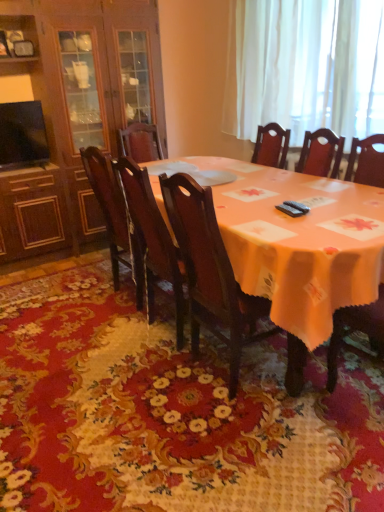
Identify the location of dark wood chair at center, the 3th chair viewed from the left. This screenshot has width=384, height=512. (211, 272).

What do you see at coordinates (211, 272) in the screenshot? I see `dark wood chair at center, the 3th chair viewed from the left` at bounding box center [211, 272].

The image size is (384, 512). I want to click on polished dark wood chair at center, marked as the 1th chair in a left-to-right arrangement, so click(x=114, y=217).

Identify the location of dark wood chair at center, which is counted as the 2th chair, starting from the right. This screenshot has height=512, width=384. (152, 239).

Measure the distance between wooden cabinet at left and camera.

They are 8.82 feet apart.

Where is `matte orange tablecloth at center`? The image size is (384, 512). matte orange tablecloth at center is located at coordinates (295, 247).

Where is `dark wood chair at center, the 3th chair viewed from the left`? dark wood chair at center, the 3th chair viewed from the left is located at coordinates (211, 272).

Does point (94, 190) appear closer or farther from the camera than point (306, 117)?

Point (94, 190).

Considering the sizes of polished dark wood chair at center, which ranks as the 3th chair in right-to-left order, and white sheer curtain at upper right in the image, is polished dark wood chair at center, which ranks as the 3th chair in right-to-left order, bigger or smaller than white sheer curtain at upper right?

Considering their sizes, polished dark wood chair at center, which ranks as the 3th chair in right-to-left order, takes up less space than white sheer curtain at upper right.

Would you say polished dark wood chair at center, marked as the 1th chair in a left-to-right arrangement, is inside or outside white sheer curtain at upper right?

polished dark wood chair at center, marked as the 1th chair in a left-to-right arrangement, is located beyond the bounds of white sheer curtain at upper right.

Is dark wood chair at center, which ranks as the 2th chair in left-to-right order, in contact with floral carpet at center?

No, dark wood chair at center, which ranks as the 2th chair in left-to-right order, is not touching floral carpet at center.

Which of these two, dark wood chair at center, which ranks as the 2th chair in left-to-right order, or floral carpet at center, stands shorter?

floral carpet at center is shorter.

From a real-world perspective, relative to floral carpet at center, is dark wood chair at center, which is counted as the 2th chair, starting from the right, vertically above or below?

dark wood chair at center, which is counted as the 2th chair, starting from the right, is above floral carpet at center.

From the image's perspective, is dark wood chair at center, which is counted as the 2th chair, starting from the right, beneath floral carpet at center?

No, from the image's perspective, dark wood chair at center, which is counted as the 2th chair, starting from the right, is not beneath floral carpet at center.

Is white sheer curtain at upper right positioned with its back to polished dark wood chair at center, marked as the 1th chair in a left-to-right arrangement?

No, white sheer curtain at upper right's orientation is not away from polished dark wood chair at center, marked as the 1th chair in a left-to-right arrangement.

Is point (371, 69) less distant than point (97, 192)?

No.

Is white sheer curtain at upper right taller than polished dark wood chair at center, which ranks as the 3th chair in right-to-left order?

Indeed, white sheer curtain at upper right has a greater height compared to polished dark wood chair at center, which ranks as the 3th chair in right-to-left order.

Based on the photo, is the position of white sheer curtain at upper right less distant than that of polished dark wood chair at center, which ranks as the 3th chair in right-to-left order?

That is False.

What's the angular difference between dark wood chair at center, which is counted as the 2th chair, starting from the right, and wooden cabinet at left's facing directions?

They differ by 90 degrees in their facing directions.

You are a GUI agent. You are given a task and a screenshot of the screen. Output one action in this format:
    pyautogui.click(x=<x>, y=<y>)
    Task: Click on the 2nd chair positioned below the wooden cabinet at left (from the image's perspective)
    This screenshot has width=384, height=512.
    Given the screenshot: What is the action you would take?
    pyautogui.click(x=152, y=239)

Does dark wood chair at center, which is counted as the 2th chair, starting from the right, come in front of wooden cabinet at left?

Yes, dark wood chair at center, which is counted as the 2th chair, starting from the right, is closer to the camera.

Is point (8, 202) behind point (302, 253)?

Yes, it is.

Is wooden cabinet at left outside of matte orange tablecloth at center?

Yes.

From the image's perspective, which one is positioned higher, wooden cabinet at left or matte orange tablecloth at center?

wooden cabinet at left.

Is wooden cabinet at left oriented away from matte orange tablecloth at center?

No, matte orange tablecloth at center is not at the back of wooden cabinet at left.

How different are the orientations of matte orange tablecloth at center and dark wood chair at center, which ranks as the 2th chair in left-to-right order, in degrees?

180 degrees.

Looking at their sizes, would you say matte orange tablecloth at center is wider or thinner than dark wood chair at center, which is counted as the 2th chair, starting from the right?

In the image, matte orange tablecloth at center appears to be wider than dark wood chair at center, which is counted as the 2th chair, starting from the right.

Considering the points (368, 239) and (135, 258), which point is behind, point (368, 239) or point (135, 258)?

The point (135, 258) is farther.

From the picture: Is matte orange tablecloth at center situated inside dark wood chair at center, which is counted as the 2th chair, starting from the right, or outside?

matte orange tablecloth at center exists outside the volume of dark wood chair at center, which is counted as the 2th chair, starting from the right.

From the image's perspective, which one is positioned lower, white sheer curtain at upper right or dark wood chair at center, the 3th chair viewed from the left?

dark wood chair at center, the 3th chair viewed from the left, from the image's perspective.

Is white sheer curtain at upper right not inside dark wood chair at center, the 3th chair viewed from the left?

That's correct, white sheer curtain at upper right is outside of dark wood chair at center, the 3th chair viewed from the left.

Between point (272, 117) and point (191, 307), which one is positioned behind?

The point (272, 117) is behind.

Is white sheer curtain at upper right beside dark wood chair at center, which is counted as the first chair, starting from the right?

No, white sheer curtain at upper right is not next to dark wood chair at center, which is counted as the first chair, starting from the right.

From the image's perspective, which chair is the 1st one below the white sheer curtain at upper right? Please provide its 2D coordinates.

[(114, 217)]

From a real-world perspective, count 2nd chairs upward from the floral carpet at center and point to it. Please provide its 2D coordinates.

[(152, 239)]

Which object lies further to the anchor point dark wood chair at center, the 3th chair viewed from the left, dark wood chair at center, which is counted as the 2th chair, starting from the right, or wooden cabinet at left?

Based on the image, wooden cabinet at left appears to be further to dark wood chair at center, the 3th chair viewed from the left.

Which object lies nearer to the anchor point dark wood chair at center, which is counted as the first chair, starting from the right, wooden cabinet at left or polished dark wood chair at center, which ranks as the 3th chair in right-to-left order?

Among the two, polished dark wood chair at center, which ranks as the 3th chair in right-to-left order, is located nearer to dark wood chair at center, which is counted as the first chair, starting from the right.

Consider the image. When comparing their distances from wooden cabinet at left, does matte orange tablecloth at center or dark wood chair at center, the 3th chair viewed from the left, seem closer?

Among the two, matte orange tablecloth at center is located nearer to wooden cabinet at left.

In the scene shown: Looking at the image, which one is located closer to wooden cabinet at left, matte orange tablecloth at center or white sheer curtain at upper right?

Among the two, white sheer curtain at upper right is located nearer to wooden cabinet at left.

Considering their positions, is dark wood chair at center, which is counted as the first chair, starting from the right, positioned closer to matte orange tablecloth at center than dark wood chair at center, which is counted as the 2th chair, starting from the right?

dark wood chair at center, which is counted as the first chair, starting from the right, is closer to matte orange tablecloth at center.

Considering their positions, is floral carpet at center positioned further to wooden cabinet at left than white sheer curtain at upper right?

Based on the image, floral carpet at center appears to be further to wooden cabinet at left.

Considering their positions, is dark wood chair at center, which is counted as the 2th chair, starting from the right, positioned further to matte orange tablecloth at center than white sheer curtain at upper right?

white sheer curtain at upper right.

Estimate the real-world distances between objects in this image. Which object is further from dark wood chair at center, the 3th chair viewed from the left, white sheer curtain at upper right or wooden cabinet at left?

Among the two, wooden cabinet at left is located further to dark wood chair at center, the 3th chair viewed from the left.

Identify the location of chair between white sheer curtain at upper right and dark wood chair at center, which is counted as the 2th chair, starting from the right, in the vertical direction. The height and width of the screenshot is (512, 384). (114, 217).

You are a GUI agent. You are given a task and a screenshot of the screen. Output one action in this format:
    pyautogui.click(x=<x>, y=<y>)
    Task: Click on the kitchen & dining room table located between floral carpet at center and dark wood chair at center, which is counted as the 2th chair, starting from the right, in the depth direction
    The height and width of the screenshot is (512, 384).
    Given the screenshot: What is the action you would take?
    pyautogui.click(x=295, y=247)

You are a GUI agent. You are given a task and a screenshot of the screen. Output one action in this format:
    pyautogui.click(x=<x>, y=<y>)
    Task: Click on the chair between floral carpet at center and dark wood chair at center, which is counted as the 2th chair, starting from the right, from front to back
    
    Given the screenshot: What is the action you would take?
    (211, 272)

Locate an element on the screen. The height and width of the screenshot is (512, 384). kitchen & dining room table located between floral carpet at center and wooden cabinet at left in the depth direction is located at coordinates (295, 247).